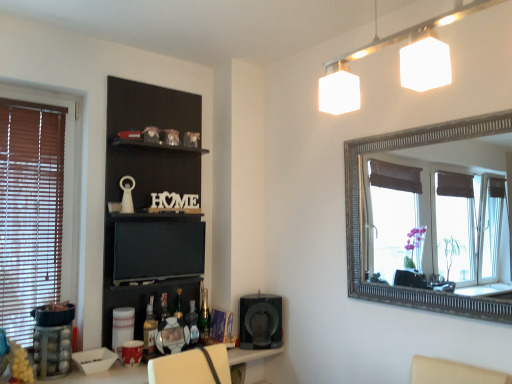
Question: Should I look upward or downward to see white glossy table at lower center?

Choices:
 (A) up
 (B) down

Answer: (B)

Question: Is white glossy table at lower center not near black matte speaker at lower center?

Choices:
 (A) yes
 (B) no

Answer: (B)

Question: Is white glossy table at lower center wider than black matte speaker at lower center?

Choices:
 (A) no
 (B) yes

Answer: (B)

Question: From the image's perspective, is white glossy table at lower center beneath black matte speaker at lower center?

Choices:
 (A) no
 (B) yes

Answer: (B)

Question: Can you confirm if white glossy table at lower center is thinner than black matte speaker at lower center?

Choices:
 (A) no
 (B) yes

Answer: (A)

Question: From the image's perspective, is white glossy table at lower center above black matte speaker at lower center?

Choices:
 (A) no
 (B) yes

Answer: (A)

Question: Does white glossy table at lower center have a larger size compared to black matte speaker at lower center?

Choices:
 (A) no
 (B) yes

Answer: (B)

Question: Does green glass bottle at lower center, which is the third bottle from front to back, appear on the right side of translucent plastic bottle at lower center, which ranks as the second bottle in back-to-front order?

Choices:
 (A) no
 (B) yes

Answer: (B)

Question: Is green glass bottle at lower center, the 3th bottle from the left, placed right next to translucent plastic bottle at lower center, which ranks as the second bottle in back-to-front order?

Choices:
 (A) yes
 (B) no

Answer: (A)

Question: From the image's perspective, is green glass bottle at lower center, the 1th bottle from the right, beneath translucent plastic bottle at lower center, marked as the second bottle in a right-to-left arrangement?

Choices:
 (A) no
 (B) yes

Answer: (A)

Question: Is green glass bottle at lower center, which is the third bottle from front to back, thinner than translucent plastic bottle at lower center, which appears as the 2th bottle when viewed from the front?

Choices:
 (A) yes
 (B) no

Answer: (A)

Question: Is green glass bottle at lower center, which is the third bottle from front to back, completely or partially outside of translucent plastic bottle at lower center, marked as the second bottle in a right-to-left arrangement?

Choices:
 (A) yes
 (B) no

Answer: (A)

Question: Is green glass bottle at lower center, the 3th bottle from the left, shorter than translucent plastic bottle at lower center, the second bottle viewed from the left?

Choices:
 (A) yes
 (B) no

Answer: (B)

Question: Does black matte shelf at upper center have a lesser width compared to white glossy table at lower center?

Choices:
 (A) no
 (B) yes

Answer: (B)